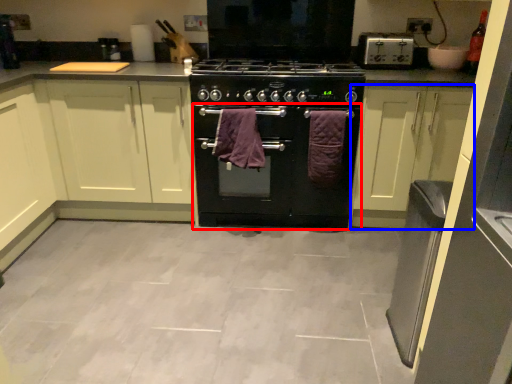
Question: Which point is closer to the camera, oven (highlighted by a red box) or cabinetry (highlighted by a blue box)?

Choices:
 (A) oven
 (B) cabinetry

Answer: (B)